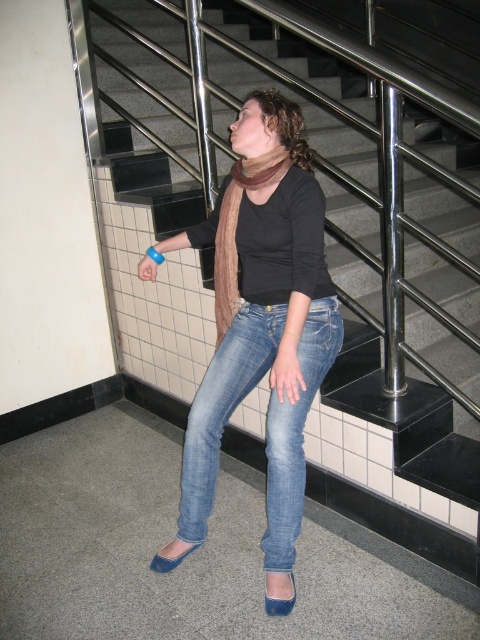
You are a fashion designer observing the person in the image. You need to determine the placement of the brown textured scarf at center and the blue rubber wristband at upper center. Which item is closer to the observer?

The brown textured scarf at center is positioned over the blue rubber wristband at upper center, so the brown textured scarf at center is closer to the observer.